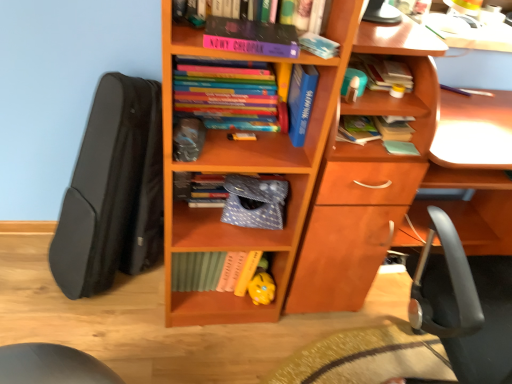
You are a GUI agent. You are given a task and a screenshot of the screen. Output one action in this format:
    pyautogui.click(x=<x>, y=<y>)
    Task: Click on the free spot in front of wooden bookcase at center
    
    Given the screenshot: What is the action you would take?
    tap(199, 350)